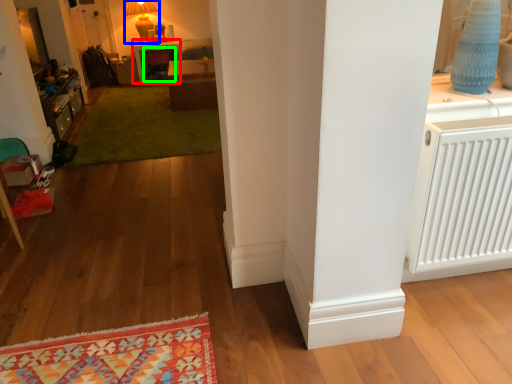
Question: Which object is the farthest from table (highlighted by a red box)? Choose among these: lamp (highlighted by a blue box) or armchair (highlighted by a green box).

Choices:
 (A) lamp
 (B) armchair

Answer: (A)